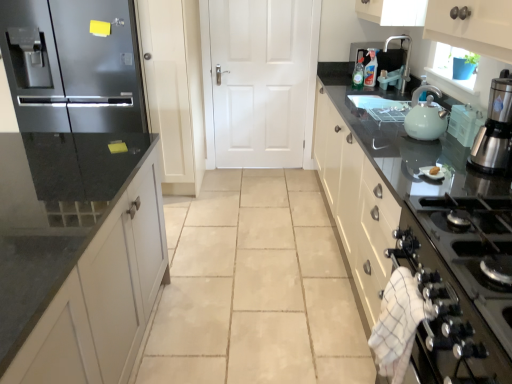
Question: Is stainless steel coffee maker at upper right wider than matte black refrigerator at left?

Choices:
 (A) no
 (B) yes

Answer: (A)

Question: Are stainless steel coffee maker at upper right and matte black refrigerator at left located far from each other?

Choices:
 (A) no
 (B) yes

Answer: (B)

Question: Is stainless steel coffee maker at upper right placed right next to matte black refrigerator at left?

Choices:
 (A) no
 (B) yes

Answer: (A)

Question: Can you confirm if stainless steel coffee maker at upper right is bigger than matte black refrigerator at left?

Choices:
 (A) yes
 (B) no

Answer: (B)

Question: Does stainless steel coffee maker at upper right appear on the right side of matte black refrigerator at left?

Choices:
 (A) no
 (B) yes

Answer: (B)

Question: In terms of size, does white glossy gas stove at lower right appear bigger or smaller than stainless steel coffee maker at upper right?

Choices:
 (A) small
 (B) big

Answer: (B)

Question: In terms of height, does white glossy gas stove at lower right look taller or shorter compared to stainless steel coffee maker at upper right?

Choices:
 (A) short
 (B) tall

Answer: (A)

Question: In terms of width, does white glossy gas stove at lower right look wider or thinner when compared to stainless steel coffee maker at upper right?

Choices:
 (A) wide
 (B) thin

Answer: (A)

Question: Is white glossy gas stove at lower right to the left or to the right of stainless steel coffee maker at upper right in the image?

Choices:
 (A) left
 (B) right

Answer: (A)

Question: In terms of size, does matte white kettle at right appear bigger or smaller than stainless steel coffee maker at upper right?

Choices:
 (A) big
 (B) small

Answer: (B)

Question: From the image's perspective, is matte white kettle at right located above or below stainless steel coffee maker at upper right?

Choices:
 (A) below
 (B) above

Answer: (B)

Question: From a real-world perspective, is matte white kettle at right above or below stainless steel coffee maker at upper right?

Choices:
 (A) below
 (B) above

Answer: (A)

Question: Is matte white kettle at right in front of or behind stainless steel coffee maker at upper right in the image?

Choices:
 (A) behind
 (B) front

Answer: (A)

Question: Does point (286, 49) appear closer or farther from the camera than point (481, 372)?

Choices:
 (A) closer
 (B) farther

Answer: (B)

Question: Is white matte door at center inside the boundaries of shiny black countertop at right, or outside?

Choices:
 (A) outside
 (B) inside

Answer: (A)